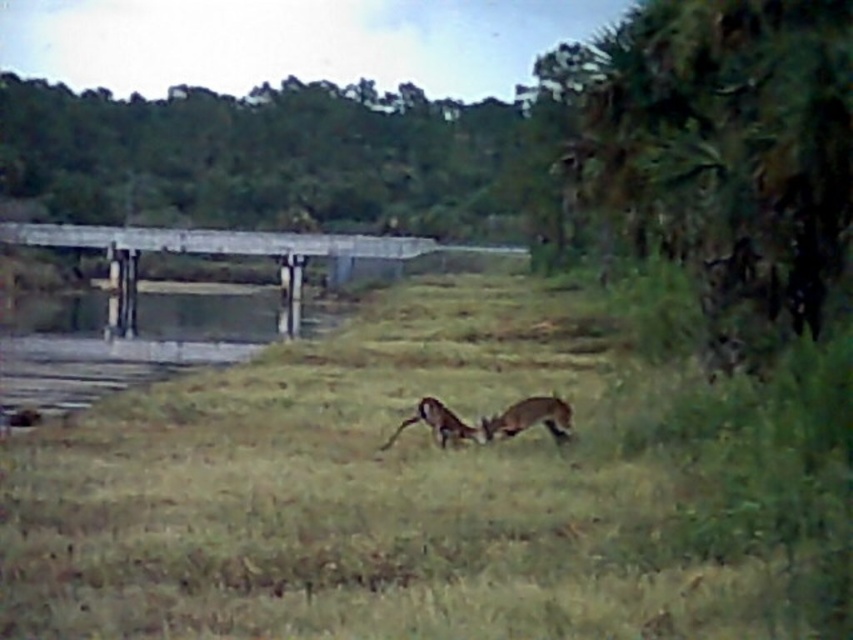
Question: Does green grass at center appear on the left side of clear water at bridge center?

Choices:
 (A) yes
 (B) no

Answer: (B)

Question: Which point is farther to the camera?

Choices:
 (A) (297, 236)
 (B) (74, 332)

Answer: (A)

Question: Considering the real-world distances, which object is closest to the clear water at bridge center?

Choices:
 (A) brown furry dog at center
 (B) green grass at center
 (C) brown furry antelope at center

Answer: (B)

Question: Does clear water at bridge center appear on the right side of brown furry dog at center?

Choices:
 (A) yes
 (B) no

Answer: (B)

Question: Which object is positioned farthest from the clear water at bridge center?

Choices:
 (A) green grass at center
 (B) brown furry dog at center
 (C) gray concrete bridge at left

Answer: (B)

Question: Can you confirm if clear water at bridge center is bigger than brown furry antelope at center?

Choices:
 (A) yes
 (B) no

Answer: (A)